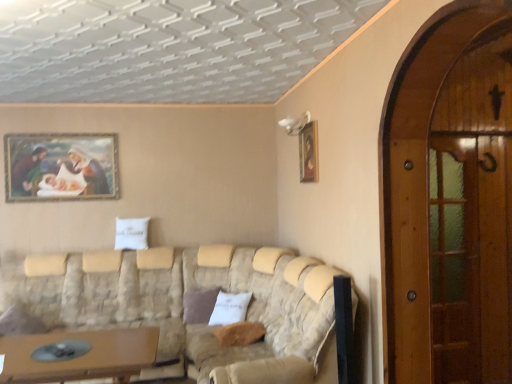
At what (x,y) coordinates should I click in order to perform the action: click on vacant space situated above wooden framed painting at upper left, arranged as the first picture frame when viewed from the back (from a real-world perspective). Please return your answer as a coordinate pair (x, y). Looking at the image, I should click on (62, 132).